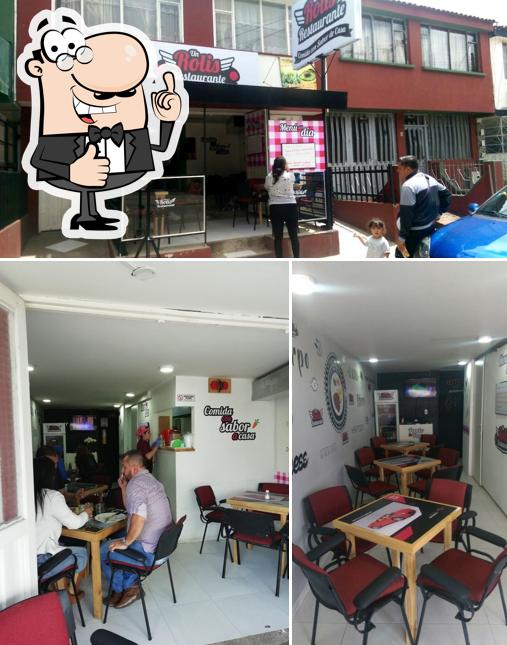
Image resolution: width=507 pixels, height=645 pixels. Find the location of `chair handles`. chair handles is located at coordinates (369, 595), (437, 582), (487, 536), (335, 540).